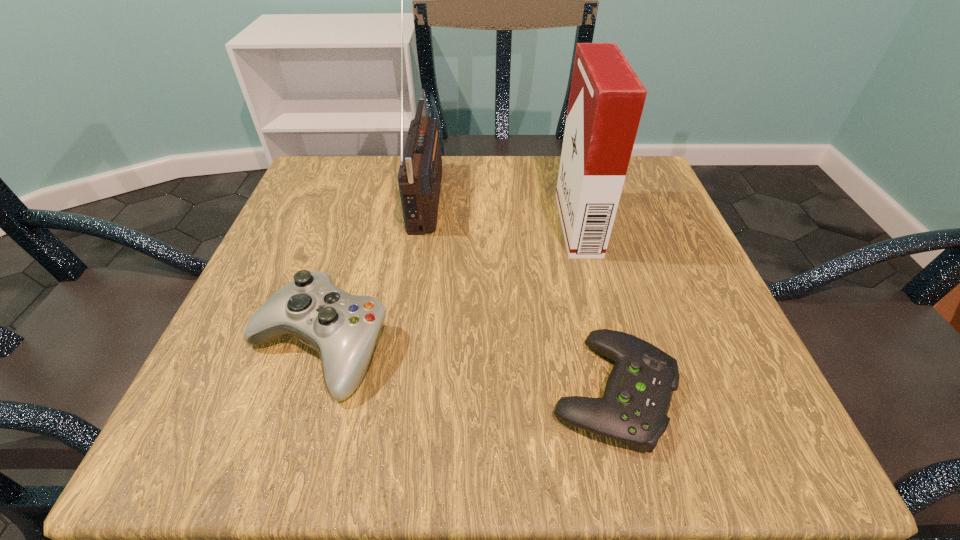
Identify the location of free space located 0.150m on the back of the taller control. This screenshot has width=960, height=540. (352, 239).

Where is `vacant position located 0.230m on the back of the shorter control`? The height and width of the screenshot is (540, 960). vacant position located 0.230m on the back of the shorter control is located at coordinates (577, 240).

I want to click on radio receiver present at the far edge, so click(x=420, y=173).

Identify the location of cigarette_case located at the far edge. The width and height of the screenshot is (960, 540). (606, 101).

Where is `object at the left edge`? object at the left edge is located at coordinates click(x=343, y=328).

I want to click on object at the right edge, so click(x=638, y=393).

This screenshot has width=960, height=540. I want to click on object positioned at the near left corner, so point(343,328).

Identify the location of object at the near right corner. Image resolution: width=960 pixels, height=540 pixels. (638, 393).

The width and height of the screenshot is (960, 540). Identify the location of vacant space at the far edge. (531, 183).

This screenshot has height=540, width=960. Find the location of `free space at the near edge of the desktop`. free space at the near edge of the desktop is located at coordinates (319, 460).